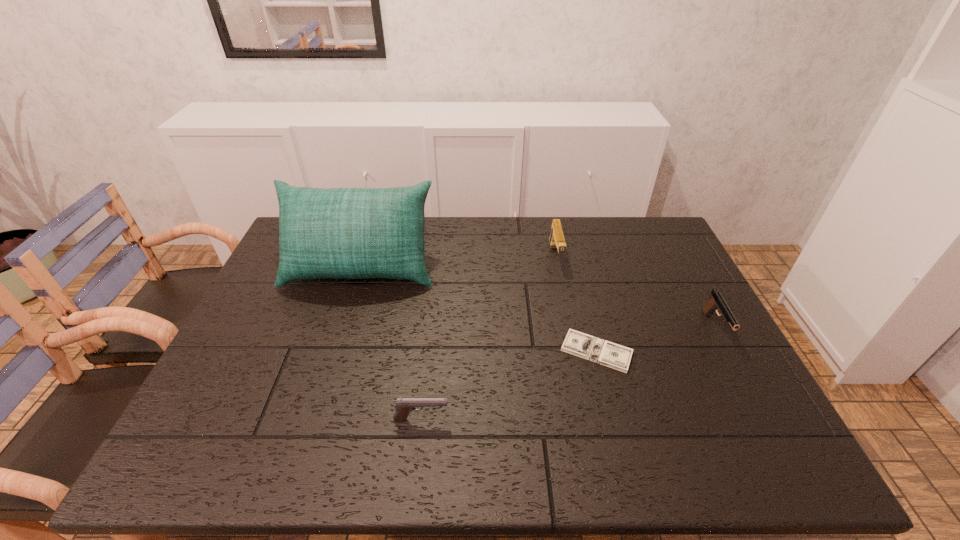
Where is `free location located 0.100m at the muzzle of the rightmost object`? The image size is (960, 540). free location located 0.100m at the muzzle of the rightmost object is located at coordinates (743, 380).

Where is `vacant space located 0.370m at the barrel of the leftmost pistol`? vacant space located 0.370m at the barrel of the leftmost pistol is located at coordinates (612, 419).

Find the location of a particular element. free space located on the back of the dollar is located at coordinates (586, 308).

Where is `cushion that is positioned at the far edge`? The height and width of the screenshot is (540, 960). cushion that is positioned at the far edge is located at coordinates (348, 233).

In order to click on pistol that is at the far edge in this screenshot , I will do `click(557, 240)`.

The image size is (960, 540). Identify the location of object situated at the left edge. (348, 233).

At what (x,y) coordinates should I click in order to perform the action: click on object that is at the right edge. Please return your answer as a coordinate pair (x, y). Looking at the image, I should click on (716, 302).

The width and height of the screenshot is (960, 540). What are the coordinates of `object that is positioned at the far left corner` in the screenshot? It's located at (348, 233).

This screenshot has height=540, width=960. I want to click on free location at the far edge, so click(x=474, y=233).

Locate an element on the screen. free space at the near edge of the desktop is located at coordinates (431, 459).